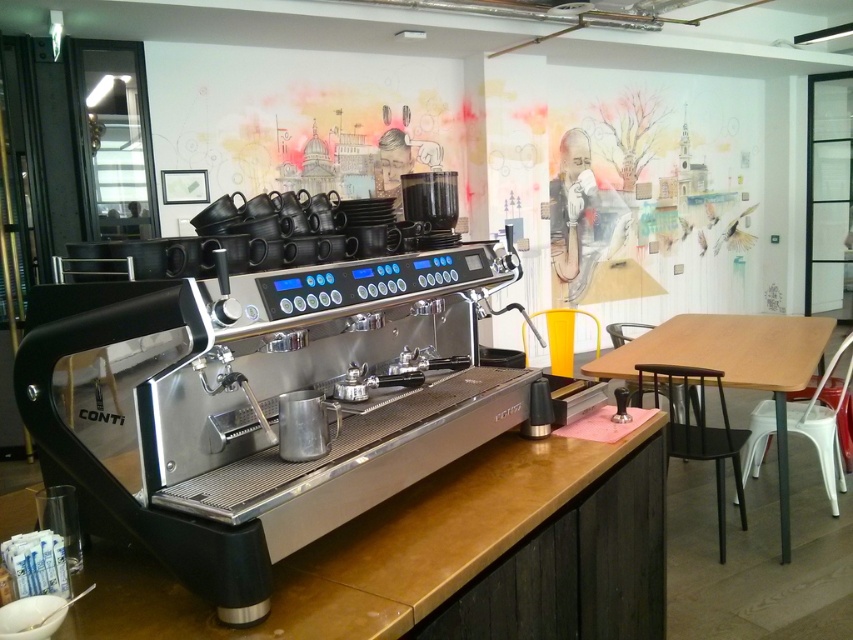
Is wooden table at right taller than smooth skin at upper center?

No, wooden table at right is not taller than smooth skin at upper center.

Which is in front, point (790, 316) or point (581, 148)?

Point (581, 148) is more forward.

In order to click on wooden table at right in this screenshot , I will do `click(735, 365)`.

Which of these two, smooth skin at upper center or black matte stool at lower right, stands shorter?

black matte stool at lower right

Between smooth skin at upper center and black matte stool at lower right, which one appears on the right side from the viewer's perspective?

Positioned to the right is smooth skin at upper center.

Locate an element on the screen. Image resolution: width=853 pixels, height=640 pixels. smooth skin at upper center is located at coordinates click(581, 216).

At what (x,y) coordinates should I click in order to perform the action: click on smooth skin at upper center. Please return your answer as a coordinate pair (x, y). Image resolution: width=853 pixels, height=640 pixels. Looking at the image, I should click on (581, 216).

Is point (641, 538) positioned in front of point (581, 141)?

Yes, point (641, 538) is in front of point (581, 141).

Identify the location of wooden countertop at center. Image resolution: width=853 pixels, height=640 pixels. (413, 548).

Between point (405, 625) and point (548, 212), which one is positioned in front?

Point (405, 625) is more forward.

Where is `wooden countertop at center`? The height and width of the screenshot is (640, 853). wooden countertop at center is located at coordinates (413, 548).